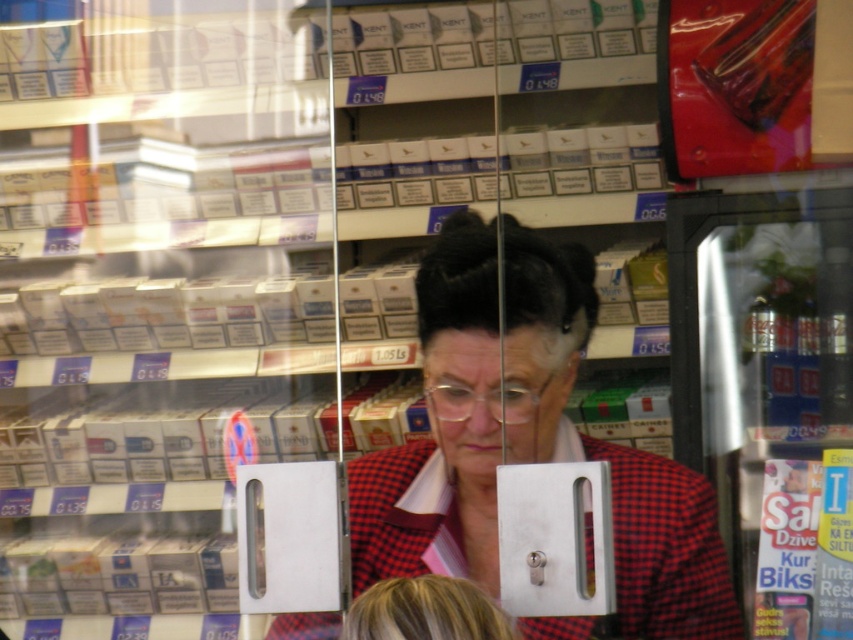
You are a delivery person who needs to place a package on the counter near the red plaid blazer at center. The package is 1.5 meters long. Can you fit it there without moving any items?

The distance between the red plaid blazer at center and the camera is 1.54 meters. Since the package is 1.5 meters long, it should fit as the available space is slightly longer than the package.

As a customer in the store, you notice the red plaid blazer at center and the blonde hair at lower center. Which of these two items is closer to you from your perspective?

The red plaid blazer at center is closer to you because the blonde hair at lower center is behind it.